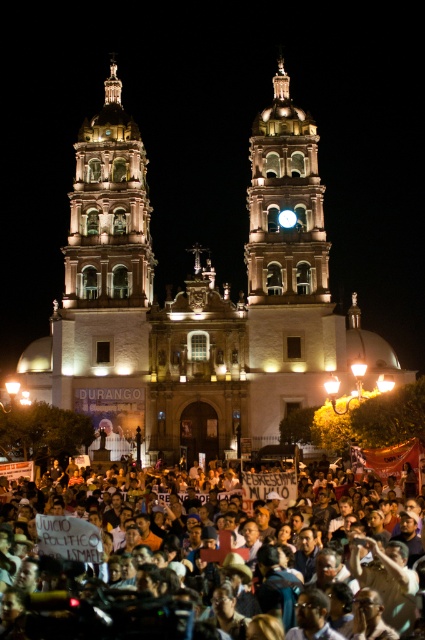
Is illuminated stone church at center above dark skin crowd at lower center?

Yes, illuminated stone church at center is above dark skin crowd at lower center.

Which is below, illuminated stone church at center or dark skin crowd at lower center?

Positioned lower is dark skin crowd at lower center.

Who is more distant from viewer, (x=183, y=376) or (x=266, y=552)?

The point (x=183, y=376) is behind.

Find the location of a particular element. This screenshot has height=640, width=425. illuminated stone church at center is located at coordinates (198, 301).